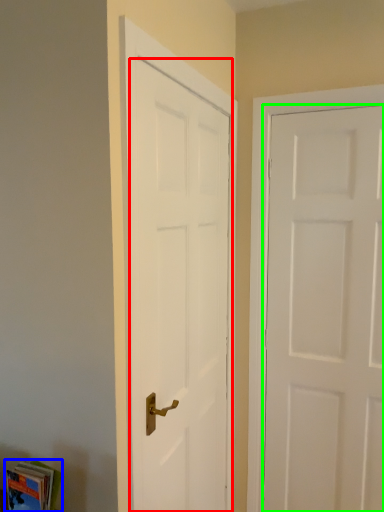
Question: Which object is the farthest from door (highlighted by a red box)? Choose among these: book (highlighted by a blue box) or door (highlighted by a green box).

Choices:
 (A) book
 (B) door

Answer: (A)